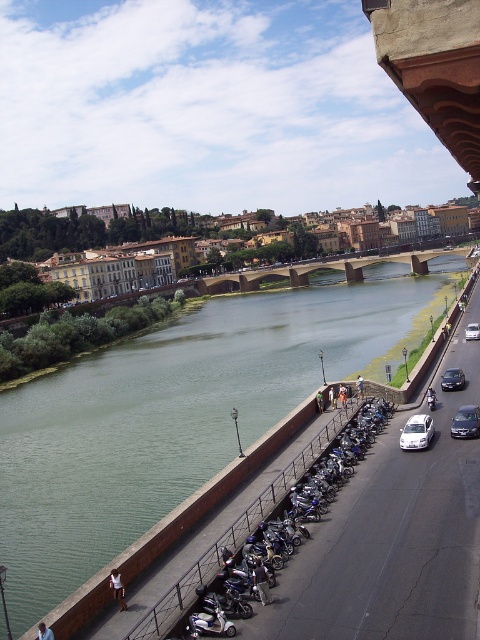
You are standing on the riverside path and want to cross to the other side. There are two vehicles parked on the road at the right side of the image, a white matte car at right and a shiny silver sedan at right. Which vehicle should you walk around first to reach the road?

You should walk around the white matte car at right first because it is closer to you than the shiny silver sedan at right, so it is in your path first.